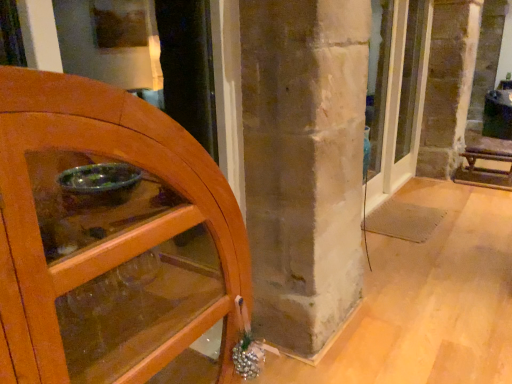
Question: Is wooden bench at right next to wooden cabinet at left, the 2th door in the back-to-front sequence, and touching it?

Choices:
 (A) no
 (B) yes

Answer: (A)

Question: Is wooden bench at right at the right side of wooden cabinet at left, which is the first door from left to right?

Choices:
 (A) no
 (B) yes

Answer: (B)

Question: Does wooden bench at right have a larger size compared to wooden cabinet at left, the 1th door viewed from the front?

Choices:
 (A) yes
 (B) no

Answer: (B)

Question: Considering the relative positions of wooden bench at right and wooden cabinet at left, the 2th door in the back-to-front sequence, in the image provided, is wooden bench at right to the left of wooden cabinet at left, the 2th door in the back-to-front sequence, from the viewer's perspective?

Choices:
 (A) no
 (B) yes

Answer: (A)

Question: Is wooden bench at right further to the viewer compared to wooden cabinet at left, which is the first door from left to right?

Choices:
 (A) no
 (B) yes

Answer: (B)

Question: Considering the relative sizes of wooden bench at right and wooden cabinet at left, placed as the second door when sorted from right to left, in the image provided, is wooden bench at right wider than wooden cabinet at left, placed as the second door when sorted from right to left,?

Choices:
 (A) no
 (B) yes

Answer: (B)

Question: Is matte glass door at center, the second door from the front, further to the viewer compared to wooden cabinet at left, the 1th door viewed from the front?

Choices:
 (A) yes
 (B) no

Answer: (A)

Question: Is there a large distance between matte glass door at center, which is the 1th door in back-to-front order, and wooden cabinet at left, the 1th door viewed from the front?

Choices:
 (A) no
 (B) yes

Answer: (B)

Question: Could wooden cabinet at left, placed as the second door when sorted from right to left, be considered to be inside matte glass door at center, the second door from the front?

Choices:
 (A) yes
 (B) no

Answer: (B)

Question: From the image's perspective, is matte glass door at center, which is the 1th door in back-to-front order, beneath wooden cabinet at left, placed as the second door when sorted from right to left?

Choices:
 (A) yes
 (B) no

Answer: (B)

Question: Is matte glass door at center, which is the 1th door in back-to-front order, bigger than wooden cabinet at left, placed as the second door when sorted from right to left?

Choices:
 (A) no
 (B) yes

Answer: (A)

Question: Considering the relative sizes of matte glass door at center, the second door from the front, and wooden cabinet at left, the 2th door in the back-to-front sequence, in the image provided, is matte glass door at center, the second door from the front, thinner than wooden cabinet at left, the 2th door in the back-to-front sequence,?

Choices:
 (A) yes
 (B) no

Answer: (A)

Question: From a real-world perspective, is wooden cabinet at left, which is the first door from left to right, beneath wooden bench at right?

Choices:
 (A) no
 (B) yes

Answer: (A)